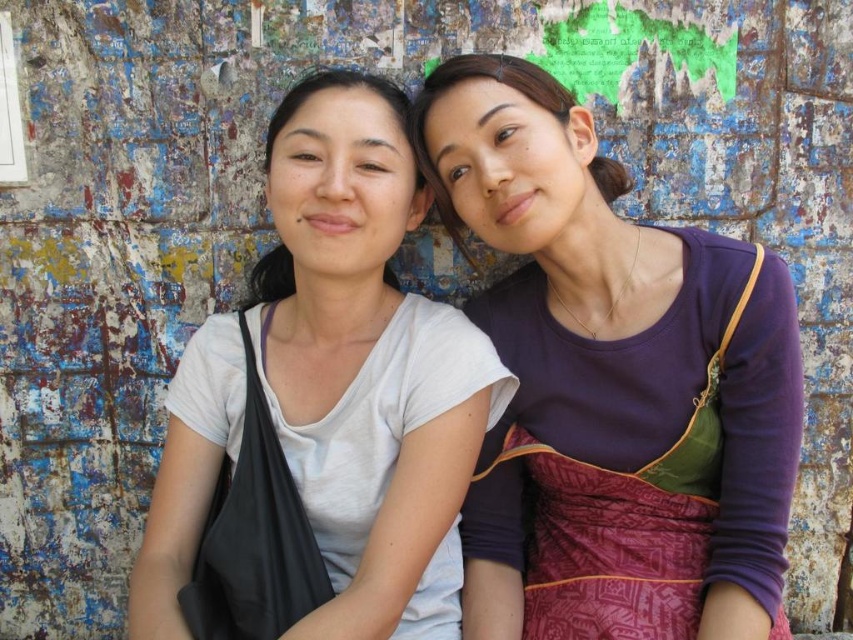
In the scene shown: Which of these two, purple cotton dress at center or matte purple dress at upper right, stands shorter?

matte purple dress at upper right

Is purple cotton dress at center bigger than matte purple dress at upper right?

Yes, purple cotton dress at center is bigger than matte purple dress at upper right.

Does point (531, 262) lie behind point (512, 86)?

Yes, point (531, 262) is farther from viewer.

Where is `purple cotton dress at center`? purple cotton dress at center is located at coordinates (612, 385).

Based on the photo, does matte purple dress at upper right have a lesser width compared to white matte shirt at center?

Correct, matte purple dress at upper right's width is less than white matte shirt at center's.

Looking at this image, who is taller, matte purple dress at upper right or white matte shirt at center?

matte purple dress at upper right is taller.

Describe the element at coordinates (473, 77) in the screenshot. The image size is (853, 640). I see `matte purple dress at upper right` at that location.

This screenshot has height=640, width=853. I want to click on matte purple dress at upper right, so click(473, 77).

Does white matte t-shirt at center appear under white matte shirt at center?

Correct, white matte t-shirt at center is located below white matte shirt at center.

Is the position of white matte t-shirt at center more distant than that of white matte shirt at center?

No, it is not.

Locate an element on the screen. The height and width of the screenshot is (640, 853). white matte t-shirt at center is located at coordinates tap(366, 364).